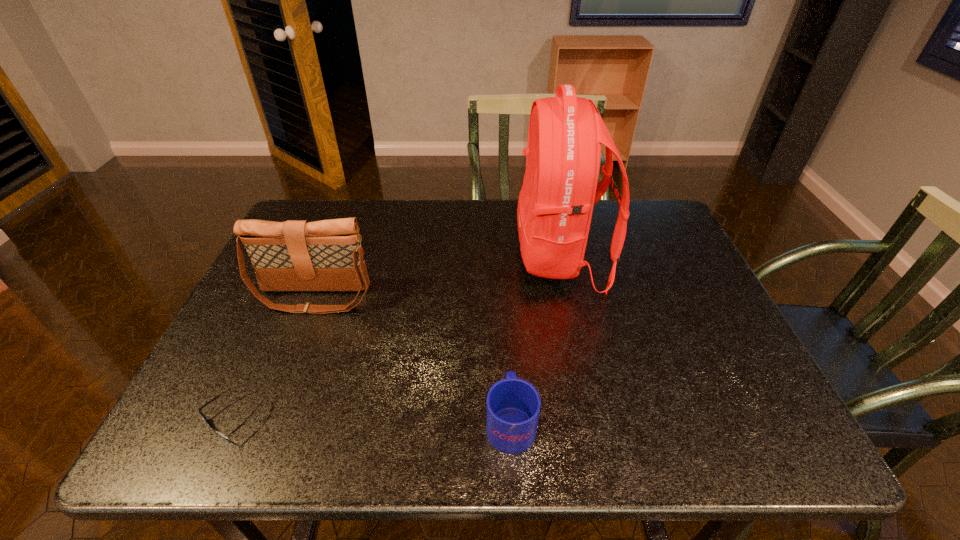
Locate an element on the screen. The image size is (960, 540). the tallest object is located at coordinates (559, 190).

Image resolution: width=960 pixels, height=540 pixels. Find the location of `the second tallest object`. the second tallest object is located at coordinates (296, 255).

Locate an element on the screen. The image size is (960, 540). the second shortest object is located at coordinates (513, 405).

Where is `sunglasses`? Image resolution: width=960 pixels, height=540 pixels. sunglasses is located at coordinates (203, 416).

Locate an element on the screen. free space located on the main compartment of the tallest object is located at coordinates [x=474, y=257].

Where is `vacant space located on the main compartment of the tallest object`? vacant space located on the main compartment of the tallest object is located at coordinates (435, 257).

This screenshot has width=960, height=540. What are the coordinates of `vacant space located on the main compartment of the tallest object` in the screenshot? It's located at (474, 257).

Where is `free point located 0.110m on the front-facing side of the shoulder bag`? free point located 0.110m on the front-facing side of the shoulder bag is located at coordinates (293, 350).

At what (x,y) coordinates should I click in order to perform the action: click on free space located on the side with the handle of the mug. Please return your answer as a coordinate pair (x, y). This screenshot has height=540, width=960. Looking at the image, I should click on (504, 299).

Image resolution: width=960 pixels, height=540 pixels. Identify the location of vacant region located 0.240m on the side with the handle of the mug. (504, 308).